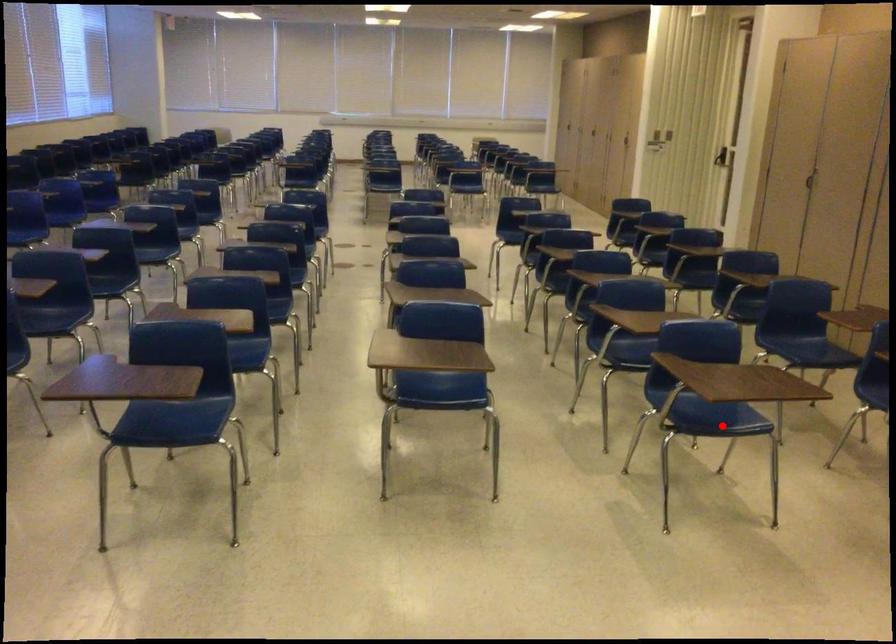
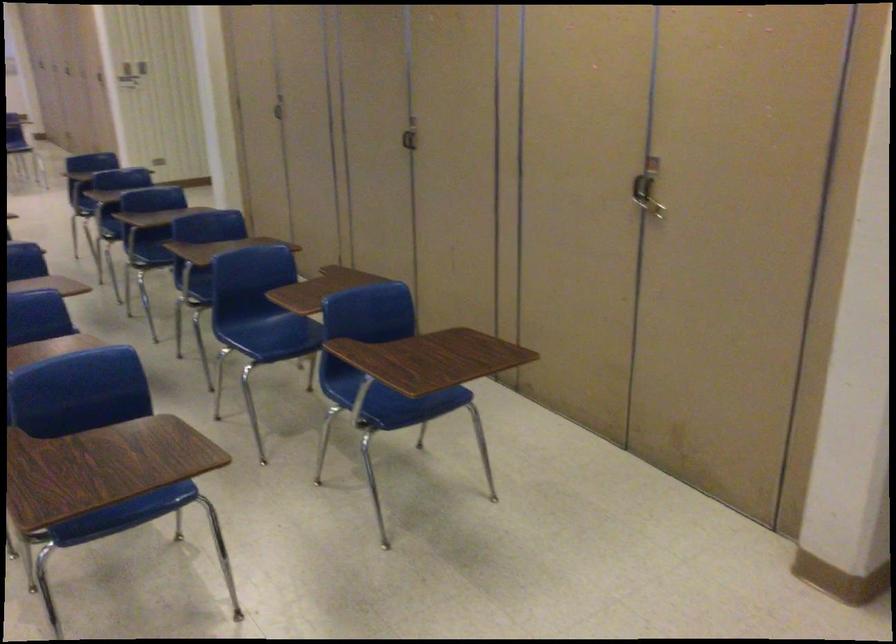
Question: I am providing you with two images of the same scene from different viewpoints. A red point is shown in image1. For the corresponding object point in image2, is it positioned nearer or farther from the camera?

Choices:
 (A) Nearer
 (B) Farther

Answer: (A)